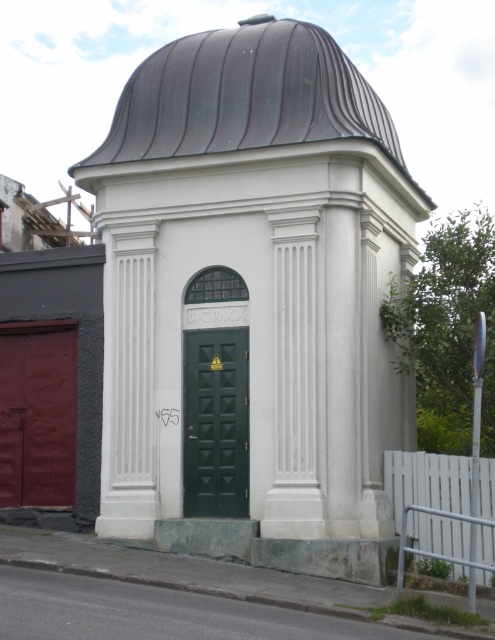
You are standing at point (x=191, y=52) and want to walk to the entrance of the dome building. The path is straight and unobstructed. If your walking speed is 1.2 meters per second, how many seconds will it take you to reach the entrance?

The distance between point (x=191, y=52) and the entrance is 15.12 meters. At a walking speed of 1.2 meters per second, it will take 15.12 divided by 1.2, which equals 12.6 seconds to reach the entrance.

In the scene shown: You are standing at point A located at point (248, 513). You want to walk to point B, which is 43.11 feet away from you. Is there enough space to walk directly to point B without any obstacles?

Yes, there is enough space to walk directly to point B without any obstacles since the distance between point A and point B is 43.11 feet, and the scene description mentions no obstacles between them.

You are standing in front of the white dome building and want to determine the relative positions of two points marked on the facade. Which point is closer to you, point 1 at coordinates point (235, 547) or point 2 at coordinates point (351, 97)?

Point 1 at coordinates point (235, 547) is closer to you than point 2 at coordinates point (351, 97).